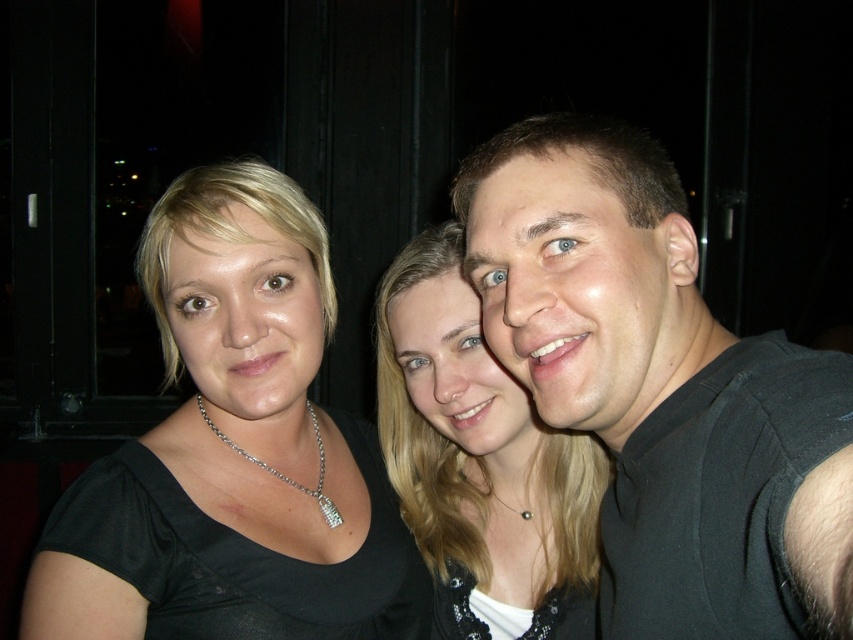
Based on the photo, does black matte shirt at right have a lesser height compared to silver/diamond necklace at center?

No, black matte shirt at right is not shorter than silver/diamond necklace at center.

Who is taller, black matte shirt at right or silver/diamond necklace at center?

With more height is black matte shirt at right.

Measure the distance between point (718, 531) and camera.

They are 25.93 inches apart.

Where is `black matte shirt at right`? The image size is (853, 640). black matte shirt at right is located at coordinates (650, 378).

Does black satin top at left have a greater height compared to silver/diamond necklace at center?

Indeed, black satin top at left has a greater height compared to silver/diamond necklace at center.

Does black satin top at left appear on the right side of silver/diamond necklace at center?

No, black satin top at left is not to the right of silver/diamond necklace at center.

The height and width of the screenshot is (640, 853). I want to click on black satin top at left, so click(234, 451).

Which of these two, black matte shirt at right or black satin top at left, stands taller?

black satin top at left

Is black matte shirt at right wider than black satin top at left?

No.

Is point (698, 406) farther from camera compared to point (225, 164)?

No, it is not.

Where is `black matte shirt at right`? Image resolution: width=853 pixels, height=640 pixels. black matte shirt at right is located at coordinates (650, 378).